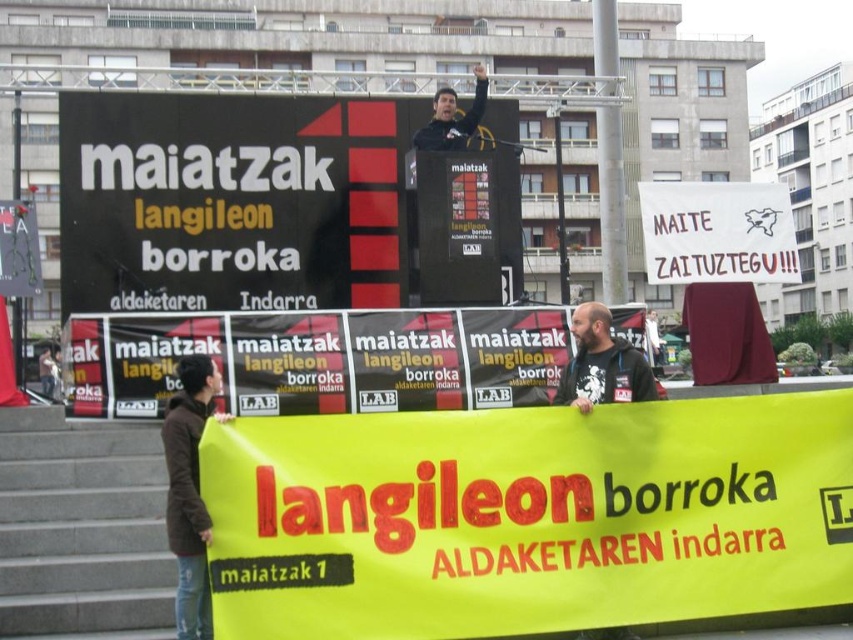
Can you confirm if yellow fabric banner at lower center is thinner than gray concrete stairs at lower left?

In fact, yellow fabric banner at lower center might be wider than gray concrete stairs at lower left.

Who is lower down, yellow fabric banner at lower center or gray concrete stairs at lower left?

yellow fabric banner at lower center

This screenshot has height=640, width=853. In order to click on yellow fabric banner at lower center in this screenshot , I will do pos(527,516).

Locate an element on the screen. yellow fabric banner at lower center is located at coordinates (527, 516).

Which of these two, black matte scoreboard at upper center or dark gray t-shirt at center, stands shorter?

With less height is dark gray t-shirt at center.

Which of these two, black matte scoreboard at upper center or dark gray t-shirt at center, stands taller?

black matte scoreboard at upper center is taller.

Describe the element at coordinates (233, 202) in the screenshot. I see `black matte scoreboard at upper center` at that location.

Where is `black matte scoreboard at upper center`? black matte scoreboard at upper center is located at coordinates (233, 202).

I want to click on yellow fabric banner at lower center, so click(x=527, y=516).

Who is more distant from viewer, (611, 440) or (177, 435)?

Positioned behind is point (611, 440).

The image size is (853, 640). Identify the location of yellow fabric banner at lower center. (527, 516).